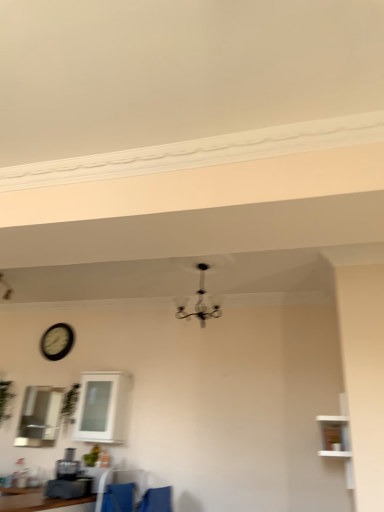
Question: Considering the relative positions of blue fabric armchair at lower center and white wooden shelf at right in the image provided, is blue fabric armchair at lower center to the right of white wooden shelf at right from the viewer's perspective?

Choices:
 (A) yes
 (B) no

Answer: (B)

Question: Can you confirm if blue fabric armchair at lower center is smaller than white wooden shelf at right?

Choices:
 (A) yes
 (B) no

Answer: (A)

Question: From a real-world perspective, is blue fabric armchair at lower center located beneath white wooden shelf at right?

Choices:
 (A) yes
 (B) no

Answer: (A)

Question: Can you confirm if blue fabric armchair at lower center is wider than white wooden shelf at right?

Choices:
 (A) no
 (B) yes

Answer: (A)

Question: Is blue fabric armchair at lower center next to white wooden shelf at right?

Choices:
 (A) no
 (B) yes

Answer: (A)

Question: From the image's perspective, relative to matte black coffee machine at lower left, is blue fabric armchair at lower center above or below?

Choices:
 (A) below
 (B) above

Answer: (A)

Question: Does point coord(165,504) appear closer or farther from the camera than point coord(77,488)?

Choices:
 (A) farther
 (B) closer

Answer: (A)

Question: Looking at the image, does blue fabric armchair at lower center seem bigger or smaller compared to matte black coffee machine at lower left?

Choices:
 (A) big
 (B) small

Answer: (B)

Question: Visually, is blue fabric armchair at lower center positioned to the left or to the right of matte black coffee machine at lower left?

Choices:
 (A) right
 (B) left

Answer: (A)

Question: Which is correct: white glossy cabinet at center, which ranks as the 2th window in left-to-right order, is inside white wooden shelf at right, or outside of it?

Choices:
 (A) inside
 (B) outside

Answer: (B)

Question: Considering the positions of white glossy cabinet at center, which ranks as the 1th window in right-to-left order, and white wooden shelf at right in the image, is white glossy cabinet at center, which ranks as the 1th window in right-to-left order, taller or shorter than white wooden shelf at right?

Choices:
 (A) tall
 (B) short

Answer: (B)

Question: Based on their positions, is white glossy cabinet at center, which ranks as the 2th window in left-to-right order, located to the left or right of white wooden shelf at right?

Choices:
 (A) left
 (B) right

Answer: (A)

Question: Does point tap(99, 425) appear closer or farther from the camera than point tap(326, 442)?

Choices:
 (A) farther
 (B) closer

Answer: (A)

Question: Is clear glass cabinet at upper left, which appears as the second window when viewed from the right, inside the boundaries of blue fabric armchair at lower center, or outside?

Choices:
 (A) outside
 (B) inside

Answer: (A)

Question: Looking at their shapes, would you say clear glass cabinet at upper left, positioned as the first window in left-to-right order, is wider or thinner than blue fabric armchair at lower center?

Choices:
 (A) thin
 (B) wide

Answer: (A)